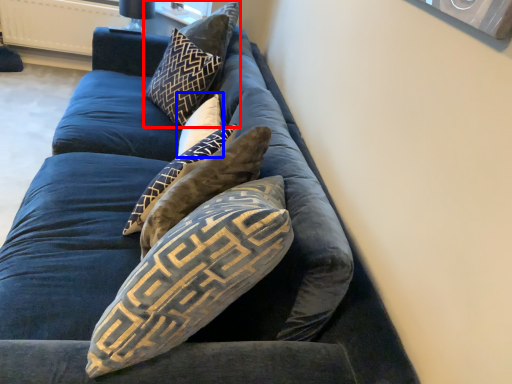
Question: Which point is further to the camera, pillow (highlighted by a red box) or pillow (highlighted by a blue box)?

Choices:
 (A) pillow
 (B) pillow

Answer: (A)